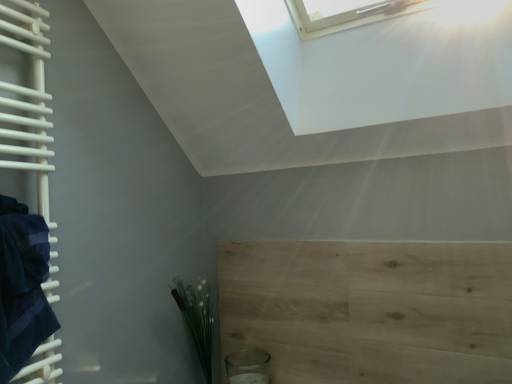
Question: Can you confirm if light wood plywood at lower right is taller than dark blue towel at left?

Choices:
 (A) yes
 (B) no

Answer: (A)

Question: Is light wood plywood at lower right facing towards dark blue towel at left?

Choices:
 (A) no
 (B) yes

Answer: (B)

Question: Does light wood plywood at lower right come in front of dark blue towel at left?

Choices:
 (A) yes
 (B) no

Answer: (B)

Question: From the image's perspective, does light wood plywood at lower right appear lower than dark blue towel at left?

Choices:
 (A) yes
 (B) no

Answer: (A)

Question: From the image's perspective, is light wood plywood at lower right located above dark blue towel at left?

Choices:
 (A) no
 (B) yes

Answer: (A)

Question: From a real-world perspective, is light wood plywood at lower right positioned under dark blue towel at left based on gravity?

Choices:
 (A) yes
 (B) no

Answer: (A)

Question: Considering the relative positions of dark blue towel at left and light wood plywood at lower right in the image provided, is dark blue towel at left to the right of light wood plywood at lower right from the viewer's perspective?

Choices:
 (A) no
 (B) yes

Answer: (A)

Question: From a real-world perspective, is dark blue towel at left physically above light wood plywood at lower right?

Choices:
 (A) no
 (B) yes

Answer: (B)

Question: From the image's perspective, is dark blue towel at left over light wood plywood at lower right?

Choices:
 (A) no
 (B) yes

Answer: (B)

Question: Is dark blue towel at left at the left side of light wood plywood at lower right?

Choices:
 (A) no
 (B) yes

Answer: (B)

Question: Does dark blue towel at left have a greater width compared to light wood plywood at lower right?

Choices:
 (A) no
 (B) yes

Answer: (B)

Question: Does dark blue towel at left lie behind light wood plywood at lower right?

Choices:
 (A) no
 (B) yes

Answer: (A)

Question: From a real-world perspective, is green matte plant at lower left positioned under dark blue towel at left based on gravity?

Choices:
 (A) no
 (B) yes

Answer: (B)